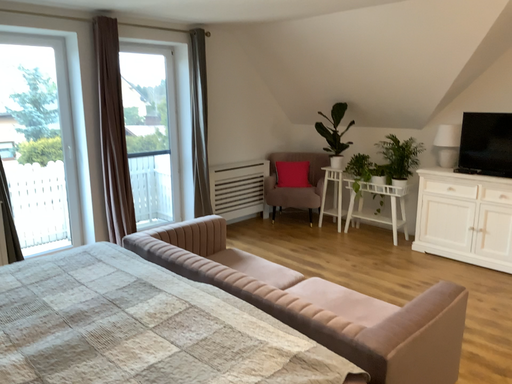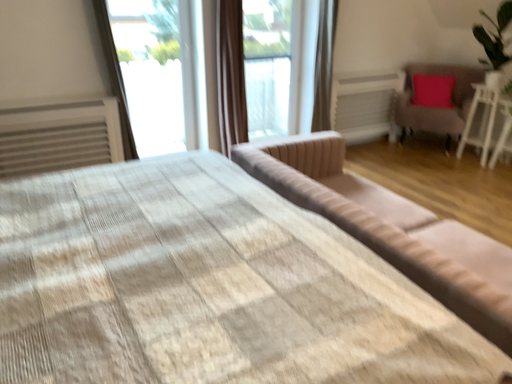
Question: How did the camera likely rotate when shooting the video?

Choices:
 (A) rotated upward
 (B) rotated downward

Answer: (B)